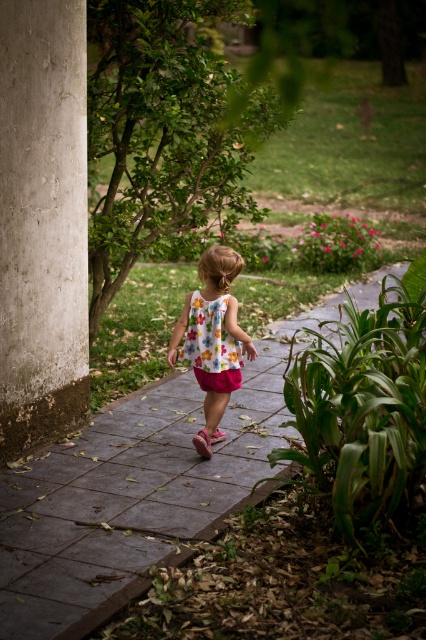
Question: Is gray concrete pavement at center above concrete pillar at left?

Choices:
 (A) yes
 (B) no

Answer: (B)

Question: Which point is farther from the camera taking this photo?

Choices:
 (A) (176, 340)
 (B) (83, 205)
 (C) (229, 355)

Answer: (B)

Question: Can you confirm if floral fabric dress at center is smaller than floral cotton dress at center?

Choices:
 (A) no
 (B) yes

Answer: (A)

Question: Can you confirm if gray concrete pavement at center is positioned to the left of floral cotton dress at center?

Choices:
 (A) no
 (B) yes

Answer: (B)

Question: Which point appears closest to the camera in this image?

Choices:
 (A) (226, 342)
 (B) (17, 205)

Answer: (B)

Question: Among these points, which one is nearest to the camera?

Choices:
 (A) (181, 353)
 (B) (36, 58)
 (C) (198, 445)
 (D) (281, 413)

Answer: (B)